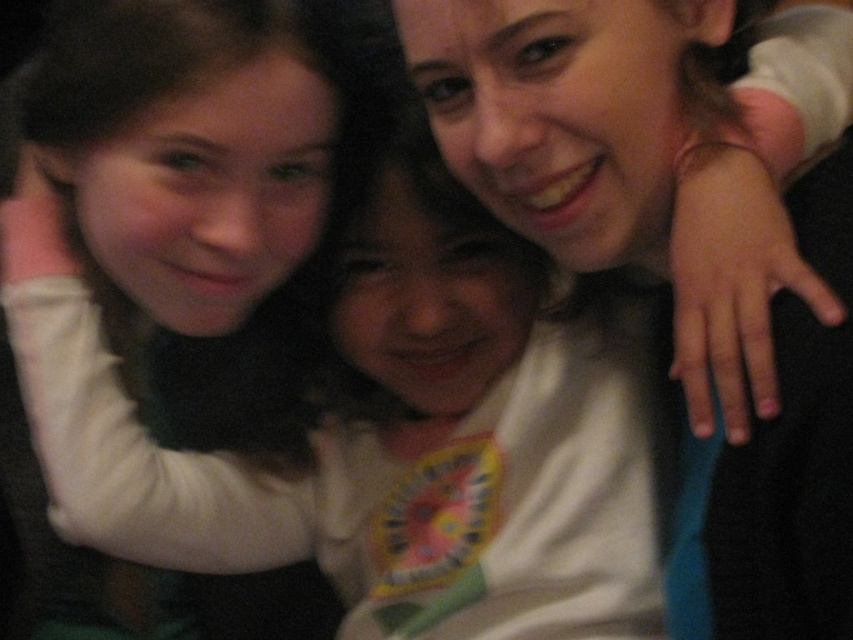
Can you confirm if white soft shirt at center is smaller than matte white shirt at upper right?

Actually, white soft shirt at center might be larger than matte white shirt at upper right.

From the picture: Can you confirm if white soft shirt at center is taller than matte white shirt at upper right?

Yes.

Describe the element at coordinates (390, 449) in the screenshot. I see `white soft shirt at center` at that location.

Where is `white soft shirt at center`? This screenshot has height=640, width=853. white soft shirt at center is located at coordinates (390, 449).